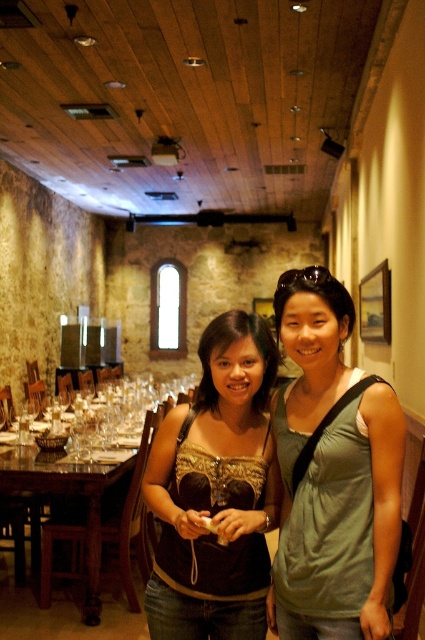
Question: Which of the following is the closest to the observer?

Choices:
 (A) wooden polished table at center
 (B) green fabric tank top at center

Answer: (B)

Question: Is green fabric tank top at center to the left of wooden polished table at center from the viewer's perspective?

Choices:
 (A) no
 (B) yes

Answer: (A)

Question: From the image, what is the correct spatial relationship of green fabric tank top at center in relation to brown fabric top at center?

Choices:
 (A) below
 (B) above

Answer: (B)

Question: Is green fabric tank top at center further to camera compared to wooden polished table at center?

Choices:
 (A) no
 (B) yes

Answer: (A)

Question: Among these objects, which one is farthest from the camera?

Choices:
 (A) green fabric tank top at center
 (B) wooden polished table at center
 (C) brown fabric top at center

Answer: (B)

Question: Which point is closer to the camera taking this photo?

Choices:
 (A) (354, 480)
 (B) (53, 490)
 (C) (265, 381)

Answer: (A)